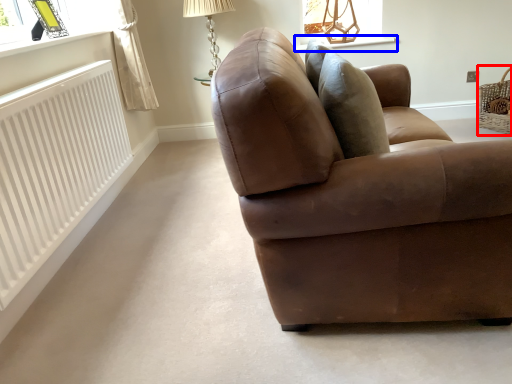
Question: Which object appears farthest to the camera in this image, basket (highlighted by a red box) or window sill (highlighted by a blue box)?

Choices:
 (A) basket
 (B) window sill

Answer: (B)